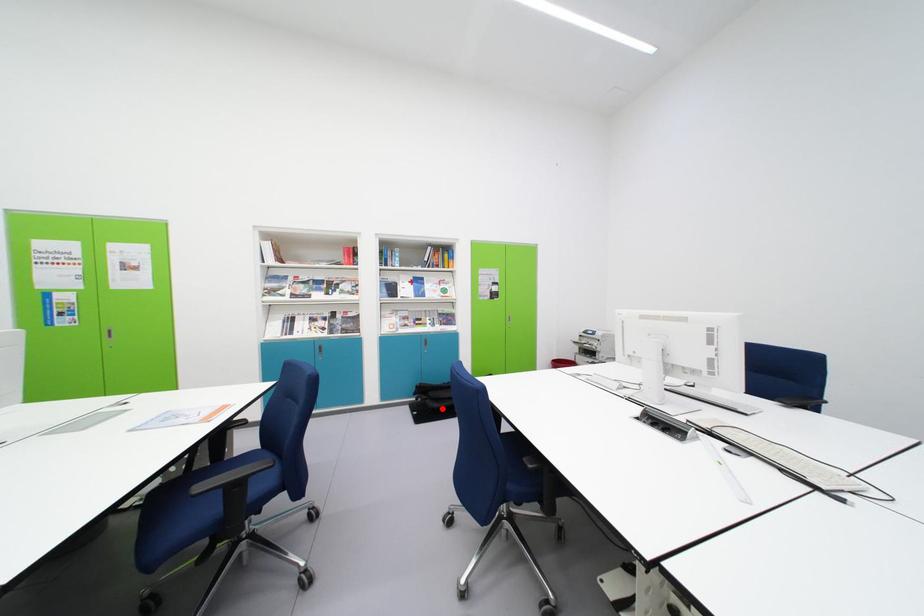
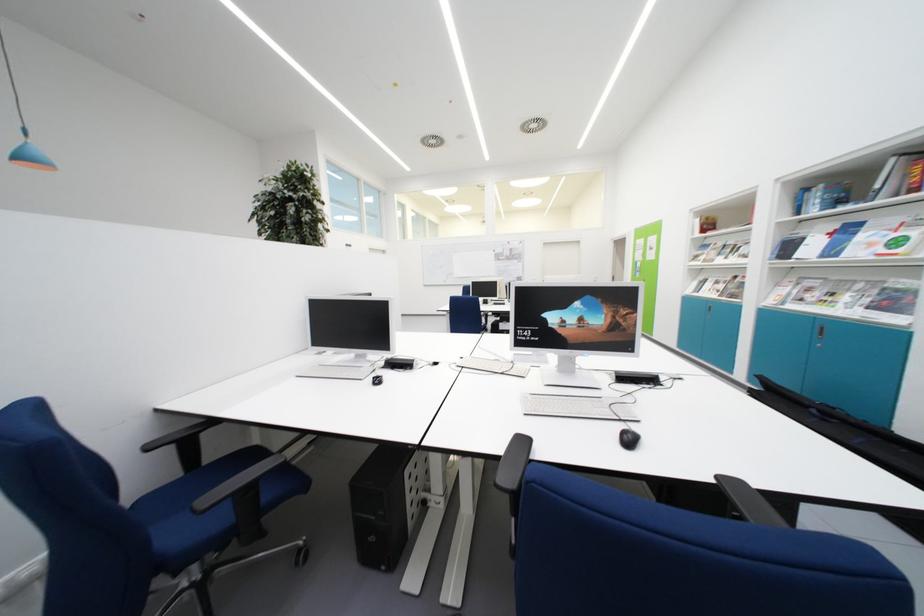
Question: I am providing you with two images of the same scene from different viewpoints. A red point is marked on the first image. Can you still see the location of the red point in image 2?

Choices:
 (A) Yes
 (B) No

Answer: (B)